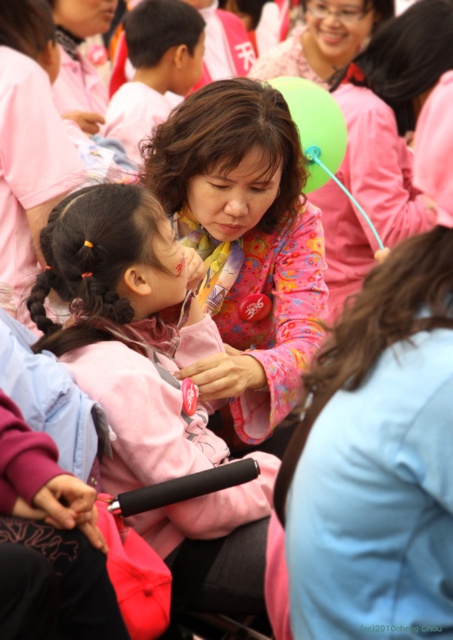
Is the position of pink fabric jacket at center more distant than that of matte pink blouse at center?

No, it is in front of matte pink blouse at center.

Does pink fabric jacket at center have a larger size compared to matte pink blouse at center?

Actually, pink fabric jacket at center might be smaller than matte pink blouse at center.

Is point (176, 531) in front of point (385, 140)?

Yes.

Where is `pink fabric jacket at center`? The image size is (453, 640). pink fabric jacket at center is located at coordinates (125, 328).

Does floral fabric blouse at center appear under matte pink shirt at upper center?

Indeed, floral fabric blouse at center is positioned under matte pink shirt at upper center.

Which is more to the right, floral fabric blouse at center or matte pink shirt at upper center?

matte pink shirt at upper center is more to the right.

Find the location of a particular element. This screenshot has width=453, height=640. floral fabric blouse at center is located at coordinates 381,438.

Can you confirm if pink fabric at center is positioned to the left of matte pink shirt at upper left?

No, pink fabric at center is not to the left of matte pink shirt at upper left.

Who is shorter, pink fabric at center or matte pink shirt at upper left?

Standing shorter between the two is pink fabric at center.

Where is `pink fabric at center`? The height and width of the screenshot is (640, 453). pink fabric at center is located at coordinates (247, 243).